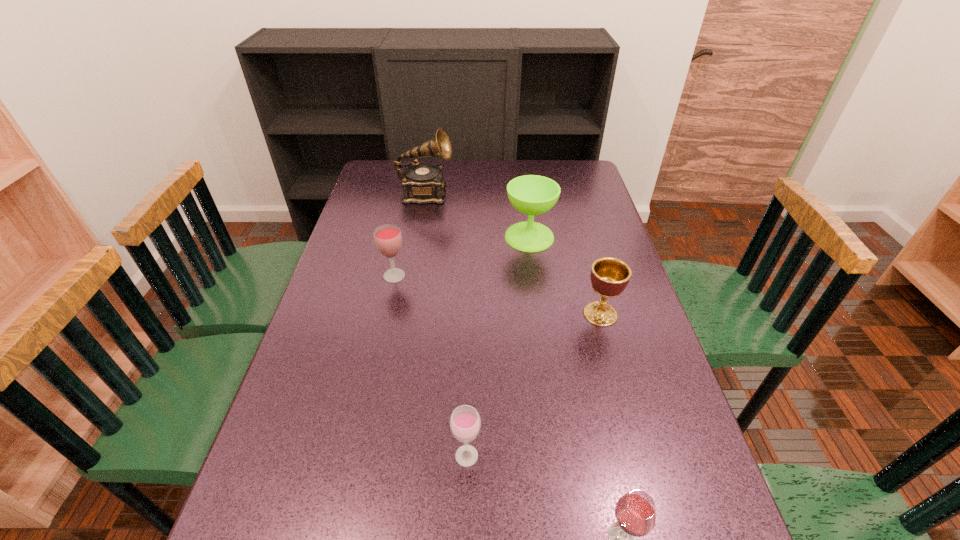
Select which object is the second closest to the second farthest wineglass. Please provide its 2D coordinates. Your answer should be formatted as a tuple, i.e. [(x, y)], where the tuple contains the x and y coordinates of a point satisfying the conditions above.

[(422, 183)]

Identify which wineglass is the closest to the nearest object. Please provide its 2D coordinates. Your answer should be formatted as a tuple, i.e. [(x, y)], where the tuple contains the x and y coordinates of a point satisfying the conditions above.

[(465, 423)]

This screenshot has width=960, height=540. Identify the location of the third closest wineglass relative to the nearest object. (530, 194).

This screenshot has width=960, height=540. I want to click on vacant area that satisfies the following two spatial constraints: 1. on the horn of the second farthest object; 2. on the left side of the tallest object, so click(x=419, y=237).